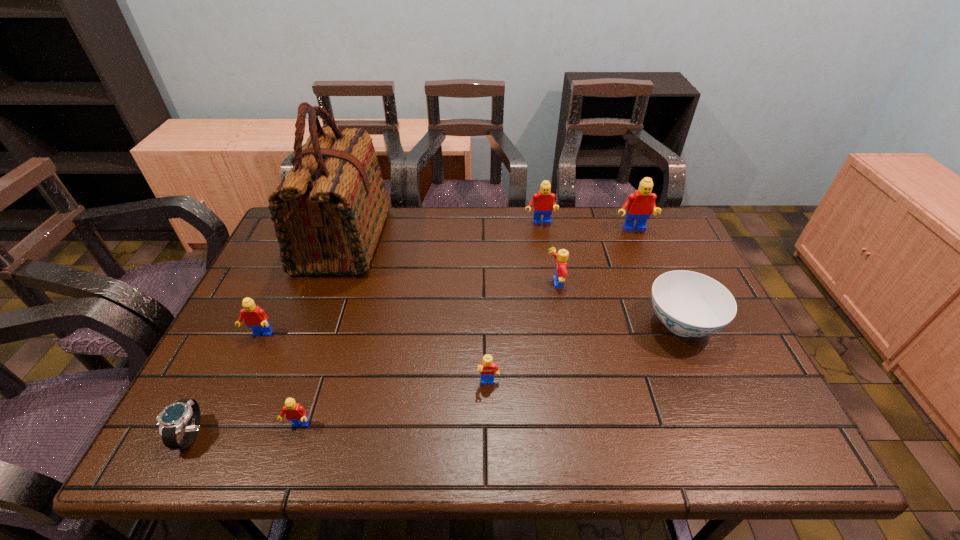
This screenshot has height=540, width=960. What are the coordinates of `free space between the farther yellow Lego and the rightmost Lego` in the screenshot? It's located at (593, 257).

Where is `vacant area that lies between the second tallest Lego and the blue chinaware`? This screenshot has width=960, height=540. vacant area that lies between the second tallest Lego and the blue chinaware is located at coordinates (611, 274).

Identify the location of vacant point located between the tallest object and the rightmost Lego. (488, 235).

The width and height of the screenshot is (960, 540). Identify the location of empty location between the watch and the fifth Lego from right to left. (244, 430).

Image resolution: width=960 pixels, height=540 pixels. Find the location of `vacant area that lies between the tallest object and the second tallest object`. vacant area that lies between the tallest object and the second tallest object is located at coordinates (488, 235).

You are a GUI agent. You are given a task and a screenshot of the screen. Output one action in this format:
    pyautogui.click(x=<x>, y=<y>)
    Task: Click on the vacant area that lies between the third farthest red Lego and the fifth Lego from right to left
    Image resolution: width=960 pixels, height=540 pixels.
    Given the screenshot: What is the action you would take?
    pyautogui.click(x=279, y=381)

Find the location of a particular element. This screenshot has height=540, width=960. empty space between the smaller yellow Lego and the nearest Lego is located at coordinates (394, 405).

You are a GUI agent. You are given a task and a screenshot of the screen. Output one action in this format:
    pyautogui.click(x=<x>, y=<y>)
    Task: Click on the vacant area that lies between the watch and the rightmost red Lego
    This screenshot has width=960, height=540.
    Given the screenshot: What is the action you would take?
    pyautogui.click(x=411, y=332)

Where is `free spot between the fourth nearest Lego and the third tallest object`? The height and width of the screenshot is (540, 960). free spot between the fourth nearest Lego and the third tallest object is located at coordinates (547, 253).

The width and height of the screenshot is (960, 540). What are the coordinates of `unoccupied position between the biggest red Lego and the fourth farthest Lego` in the screenshot? It's located at (446, 282).